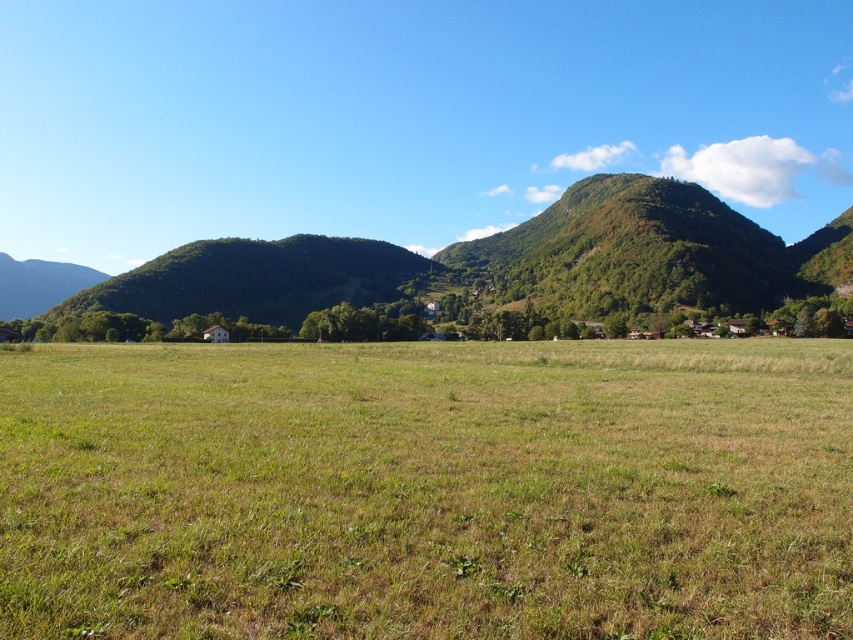
Question: Which object appears farthest from the camera in this image?

Choices:
 (A) green grass pasture at center
 (B) green grassy hill at center

Answer: (B)

Question: Does green grass pasture at center have a greater width compared to green grassy hill at center?

Choices:
 (A) yes
 (B) no

Answer: (B)

Question: Which of the following is the closest to the observer?

Choices:
 (A) (482, 269)
 (B) (315, 566)

Answer: (B)

Question: Can you confirm if green grass pasture at center is smaller than green grassy hill at center?

Choices:
 (A) no
 (B) yes

Answer: (B)

Question: Can you confirm if green grass pasture at center is thinner than green grassy hill at center?

Choices:
 (A) yes
 (B) no

Answer: (A)